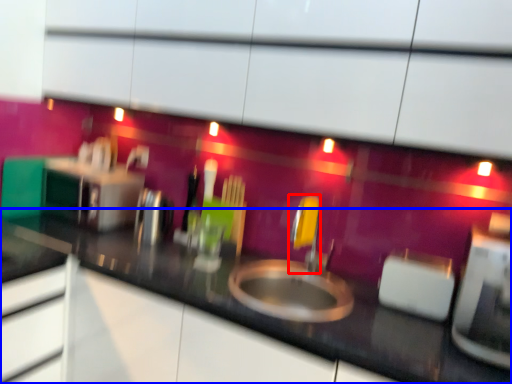
Question: Which object is further to the camera taking this photo, faucet (highlighted by a red box) or countertop (highlighted by a blue box)?

Choices:
 (A) faucet
 (B) countertop

Answer: (A)